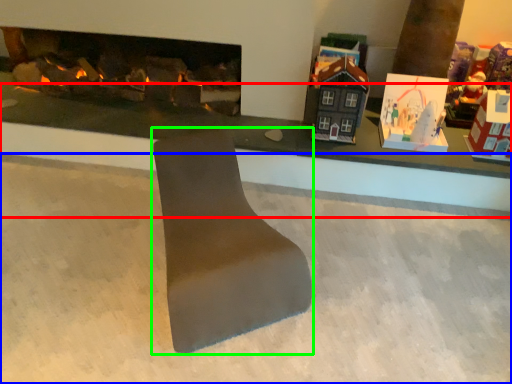
Question: Considering the real-world distances, which object is farthest from table (highlighted by a red box)? concrete (highlighted by a blue box) or footrest (highlighted by a green box)?

Choices:
 (A) concrete
 (B) footrest

Answer: (B)